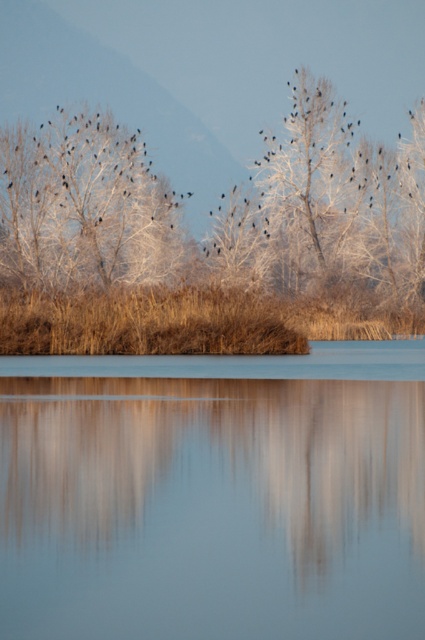
At what (x,y) coordinates should I click in order to perform the action: click on smooth glass water at center. Please return your answer as a coordinate pair (x, y). Looking at the image, I should click on (214, 493).

Is smooth glass water at center taller than white frosty tree at upper left?

No.

The height and width of the screenshot is (640, 425). In order to click on smooth glass water at center in this screenshot , I will do `click(214, 493)`.